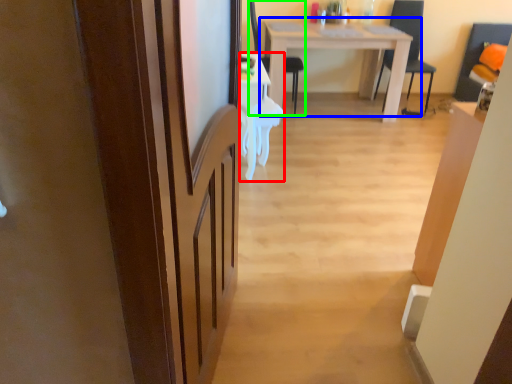
Question: Which object is the closest to the desk (highlighted by a red box)? Choose among these: table (highlighted by a blue box) or chair (highlighted by a green box).

Choices:
 (A) table
 (B) chair

Answer: (B)